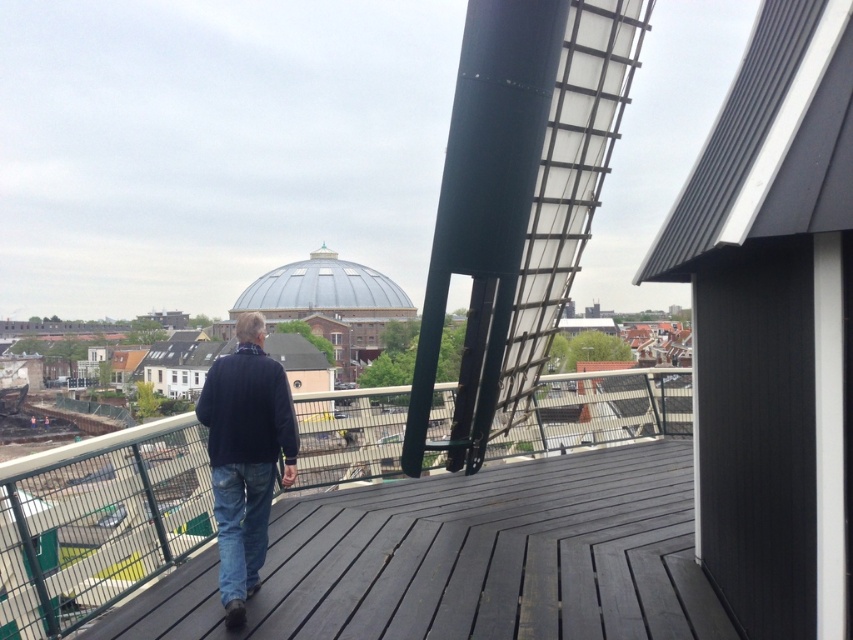
Does dark blue sweater at center have a greater height compared to metallic silver dome at center?

In fact, dark blue sweater at center may be shorter than metallic silver dome at center.

Is dark blue sweater at center to the right of metallic silver dome at center from the viewer's perspective?

Correct, you'll find dark blue sweater at center to the right of metallic silver dome at center.

The width and height of the screenshot is (853, 640). What do you see at coordinates (245, 456) in the screenshot?
I see `dark blue sweater at center` at bounding box center [245, 456].

The image size is (853, 640). I want to click on dark blue sweater at center, so click(x=245, y=456).

Consider the image. Is dark blue sweater at center thinner than blue denim jeans at center?

In fact, dark blue sweater at center might be wider than blue denim jeans at center.

Does point (265, 532) come in front of point (234, 582)?

No, it is not.

The height and width of the screenshot is (640, 853). Find the location of `dark blue sweater at center`. dark blue sweater at center is located at coordinates (245, 456).

Can you confirm if metallic silver dome at center is wider than blue denim jeans at center?

Correct, the width of metallic silver dome at center exceeds that of blue denim jeans at center.

Does metallic silver dome at center have a larger size compared to blue denim jeans at center?

Yes.

Is point (360, 307) farther from camera compared to point (213, 502)?

Yes, it is.

I want to click on metallic silver dome at center, so click(x=323, y=291).